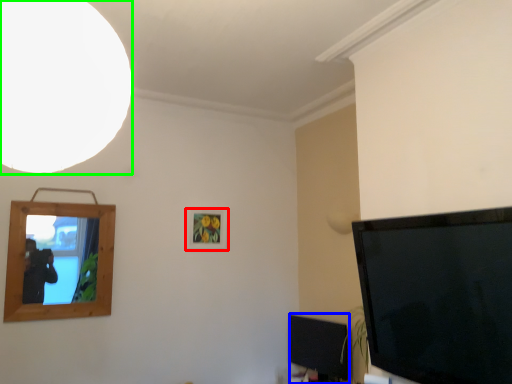
Question: Based on their relative distances, which object is farther from picture frame (highlighted by a red box)? Choose from television (highlighted by a blue box) and light (highlighted by a green box).

Choices:
 (A) television
 (B) light

Answer: (B)